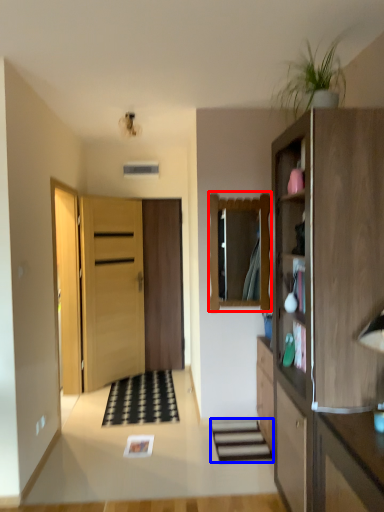
Question: Which point is further to the camera, mirror (highlighted by a red box) or stairwell (highlighted by a blue box)?

Choices:
 (A) mirror
 (B) stairwell

Answer: (A)